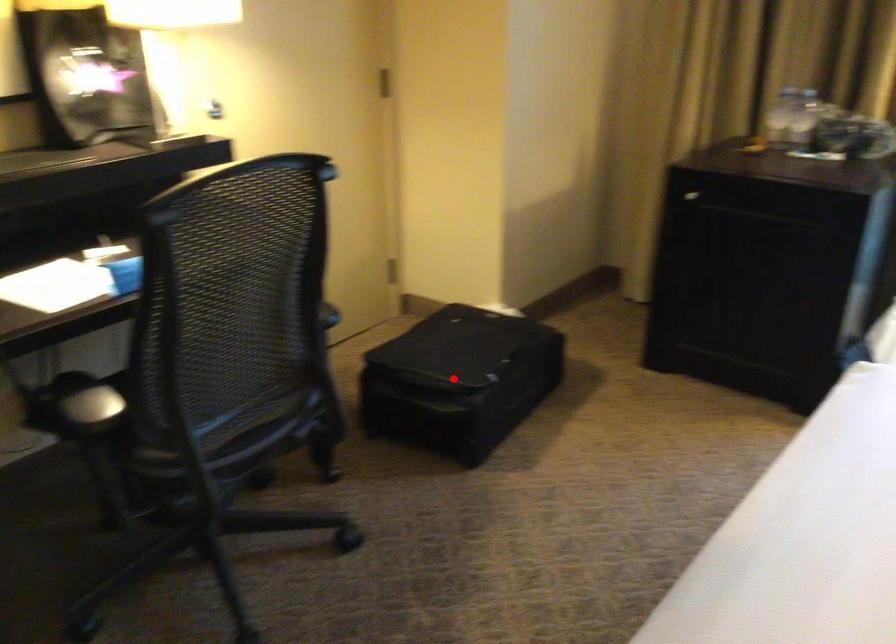
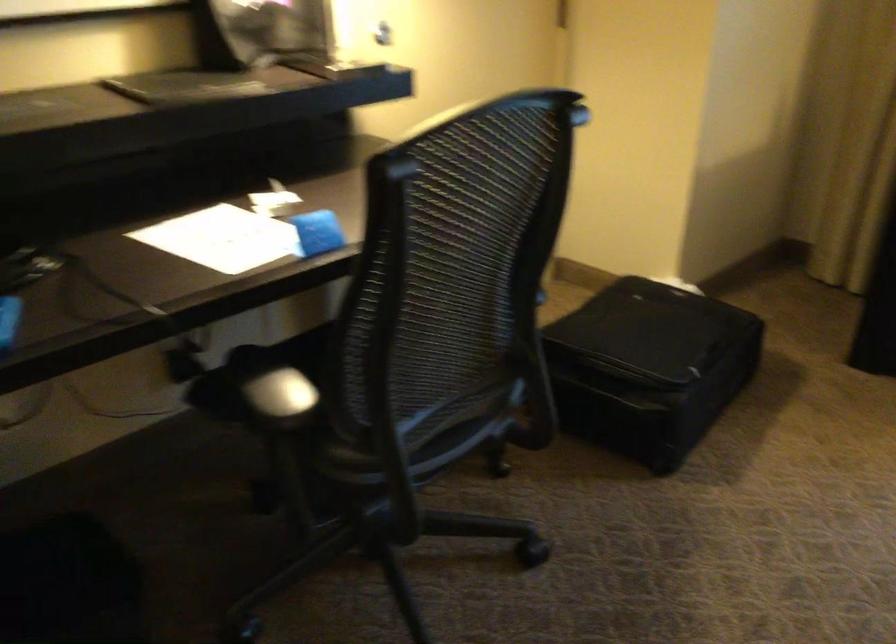
Question: I am providing you with two images of the same scene from different viewpoints. A red point is shown in image1. For the corresponding object point in image2, is it positioned nearer or farther from the camera?

Choices:
 (A) Nearer
 (B) Farther

Answer: (A)